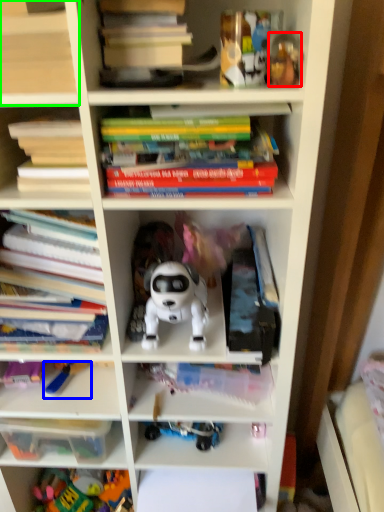
Question: Considering the real-world distances, which object is closest to toy (highlighted by a red box)? toy (highlighted by a blue box) or shelf (highlighted by a green box).

Choices:
 (A) toy
 (B) shelf

Answer: (B)